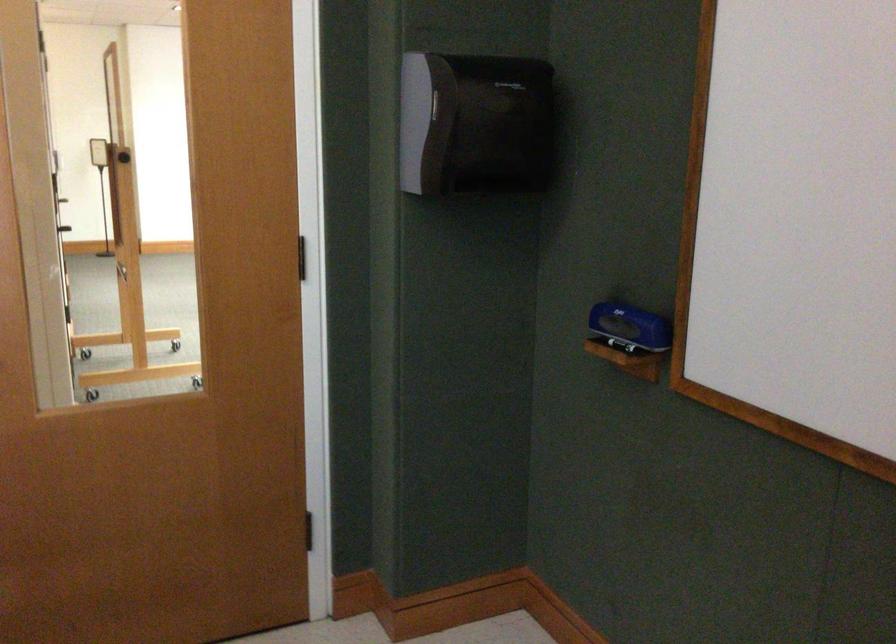
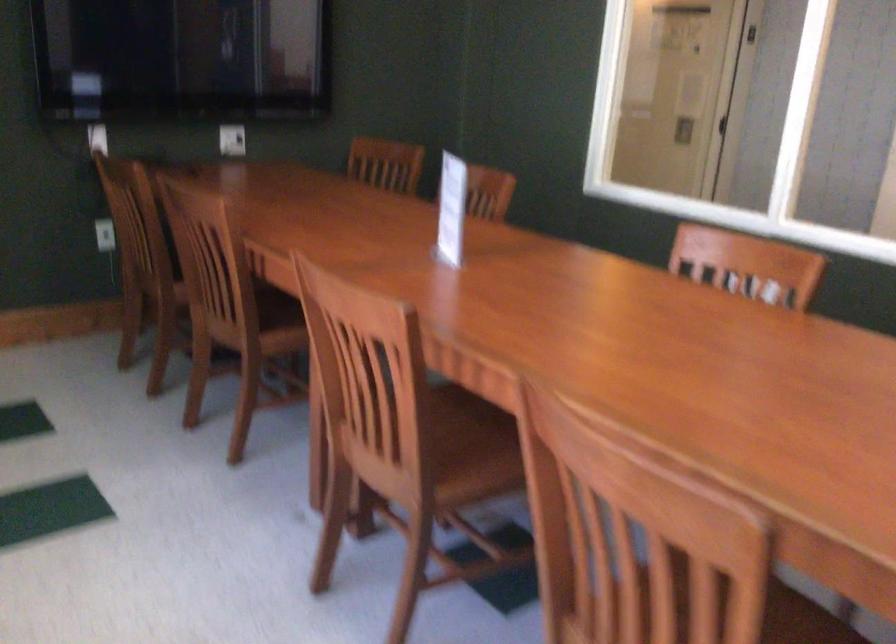
Based on the continuous images, in which direction is the camera rotating?

The rotation direction of the camera is left-down.